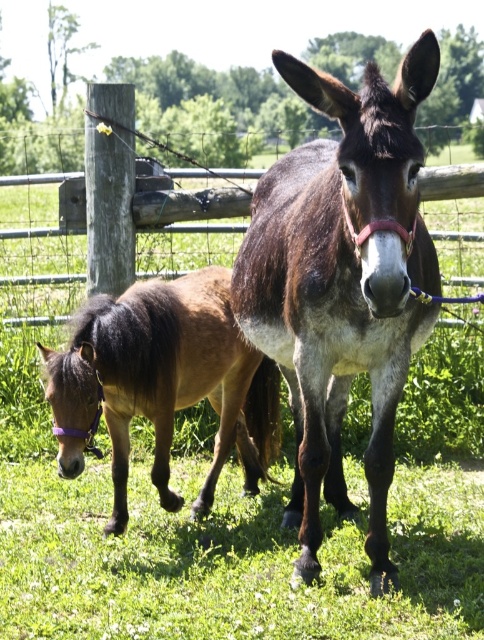
Question: Which point is farther to the camera?

Choices:
 (A) (317, 300)
 (B) (181, 497)

Answer: (B)

Question: Is brown fuzzy mule at center above brown fuzzy pony at lower left?

Choices:
 (A) yes
 (B) no

Answer: (A)

Question: Can you confirm if brown fuzzy mule at center is wider than brown fuzzy pony at lower left?

Choices:
 (A) no
 (B) yes

Answer: (A)

Question: Which point is closer to the camera?

Choices:
 (A) brown fuzzy mule at center
 (B) brown fuzzy pony at lower left

Answer: (A)

Question: Can you confirm if brown fuzzy mule at center is positioned above brown fuzzy pony at lower left?

Choices:
 (A) no
 (B) yes

Answer: (B)

Question: Which object appears closest to the camera in this image?

Choices:
 (A) brown fuzzy pony at lower left
 (B) brown fuzzy mule at center

Answer: (B)